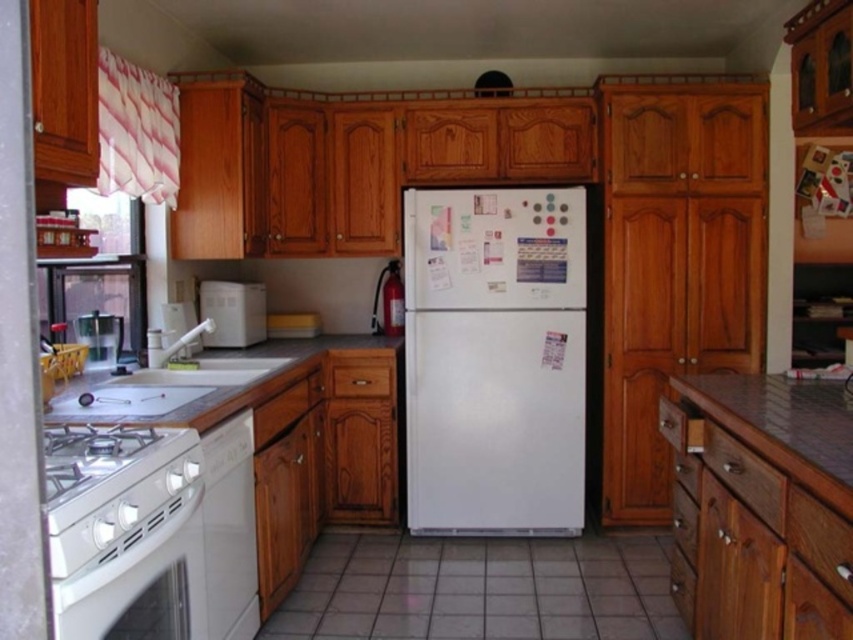
Question: Which point appears closest to the camera in this image?

Choices:
 (A) (103, 339)
 (B) (245, 442)
 (C) (212, 316)
 (D) (115, 452)

Answer: (D)

Question: Which object is farther from the camera taking this photo?

Choices:
 (A) white laminate countertop at lower left
 (B) white glossy oven at lower left
 (C) metallic silver sink at left

Answer: (C)

Question: Which of the following is the closest to the observer?

Choices:
 (A) white laminate countertop at lower left
 (B) metallic silver sink at left
 (C) white glossy dishwasher at lower left
 (D) metallic silver counter top at lower right

Answer: (D)

Question: Can you confirm if white matte microwave at center is wider than metallic silver sink at left?

Choices:
 (A) yes
 (B) no

Answer: (A)

Question: Is white matte refrigerator at center smaller than metallic silver sink at left?

Choices:
 (A) no
 (B) yes

Answer: (A)

Question: Is white glossy oven at lower left above white laminate countertop at lower left?

Choices:
 (A) yes
 (B) no

Answer: (B)